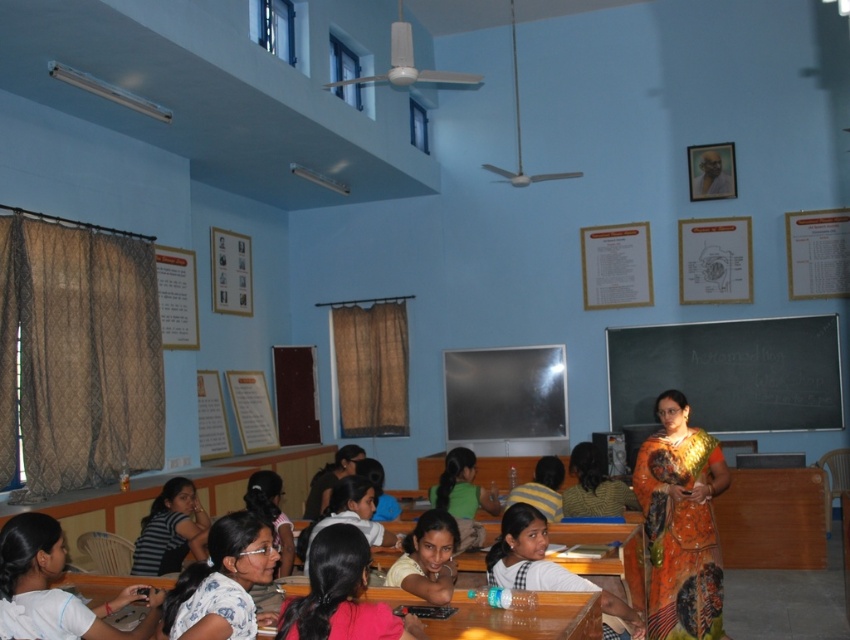
Is blackboard at center wider than white fabric shirt at lower left?

Indeed, blackboard at center has a greater width compared to white fabric shirt at lower left.

What do you see at coordinates (731, 372) in the screenshot?
I see `blackboard at center` at bounding box center [731, 372].

The image size is (850, 640). Identify the location of blackboard at center. (731, 372).

Who is more distant from viewer, (672, 577) or (518, 552)?

The point (672, 577) is behind.

Is point (653, 484) positioned after point (588, 589)?

Yes, point (653, 484) is behind point (588, 589).

You are a GUI agent. You are given a task and a screenshot of the screen. Output one action in this format:
    pyautogui.click(x=<x>, y=<y>)
    Task: Click on the printed silk sari at center
    The width and height of the screenshot is (850, 640).
    Given the screenshot: What is the action you would take?
    pyautogui.click(x=681, y=524)

Can you confirm if printed silk sari at center is wider than light pink fabric shirt at center?

Indeed, printed silk sari at center has a greater width compared to light pink fabric shirt at center.

Is printed silk sari at center positioned in front of light pink fabric shirt at center?

Yes, it is in front of light pink fabric shirt at center.

Measure the distance between point (666, 614) and camera.

Point (666, 614) and camera are 4.09 meters apart from each other.

Identify the location of printed silk sari at center. The image size is (850, 640). (681, 524).